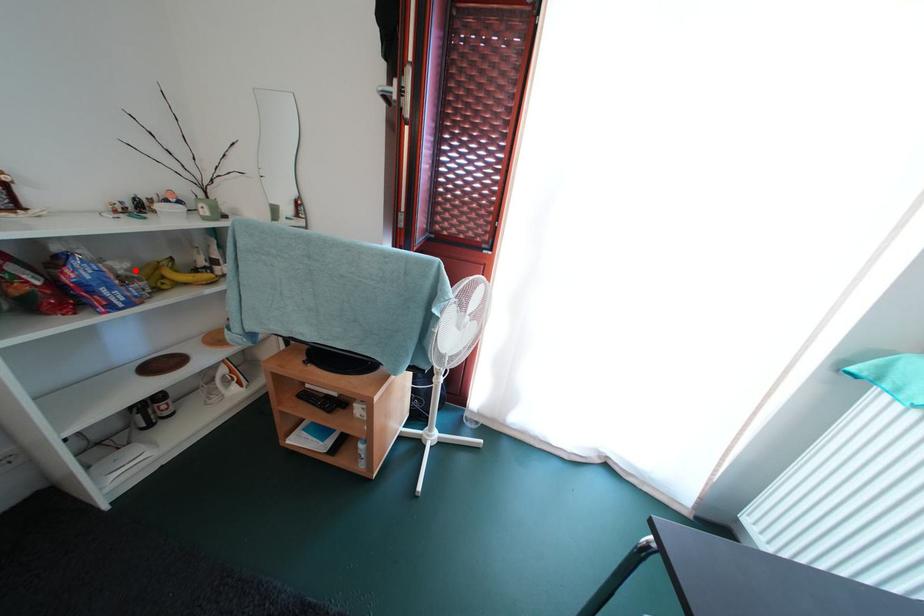
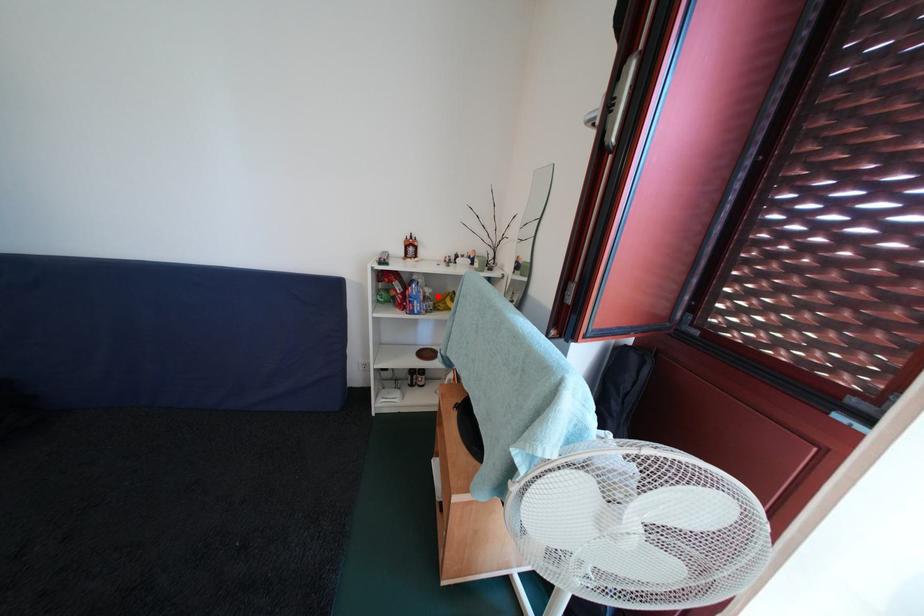
I am providing you with two images of the same scene from different viewpoints. A red point is marked on the first image and another point is marked on the second image. Is the marked point in image1 the same physical position as the marked point in image2?

Yes